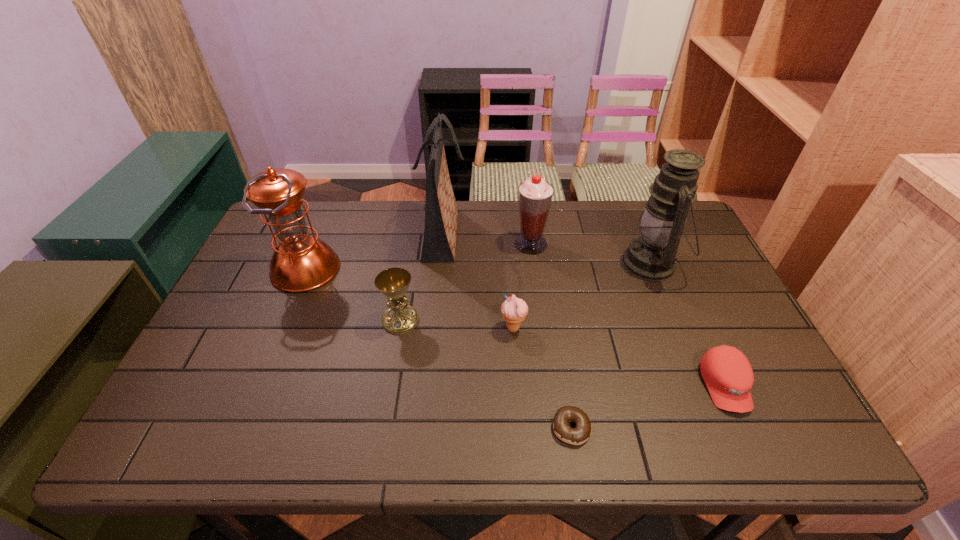
Where is `object that is at the left edge`? This screenshot has width=960, height=540. object that is at the left edge is located at coordinates (301, 262).

This screenshot has width=960, height=540. I want to click on oil lamp situated at the right edge, so click(x=652, y=256).

Find the location of a particular element. This screenshot has width=960, height=540. cap at the right edge is located at coordinates (728, 375).

Locate an element on the screen. object present at the far right corner is located at coordinates (652, 256).

This screenshot has height=540, width=960. I want to click on object that is at the near right corner, so [x=728, y=375].

Identify the location of blank space at the far edge. tap(378, 223).

The image size is (960, 540). Identify the location of vacant space at the near edge of the desktop. (311, 428).

In the image, there is a desktop. Where is `vacant space at the left edge`? This screenshot has height=540, width=960. vacant space at the left edge is located at coordinates (249, 282).

What are the coordinates of `vacant space at the right edge of the desktop` in the screenshot? It's located at (709, 310).

This screenshot has height=540, width=960. Identify the location of vacant space at the far left corner of the desktop. (323, 210).